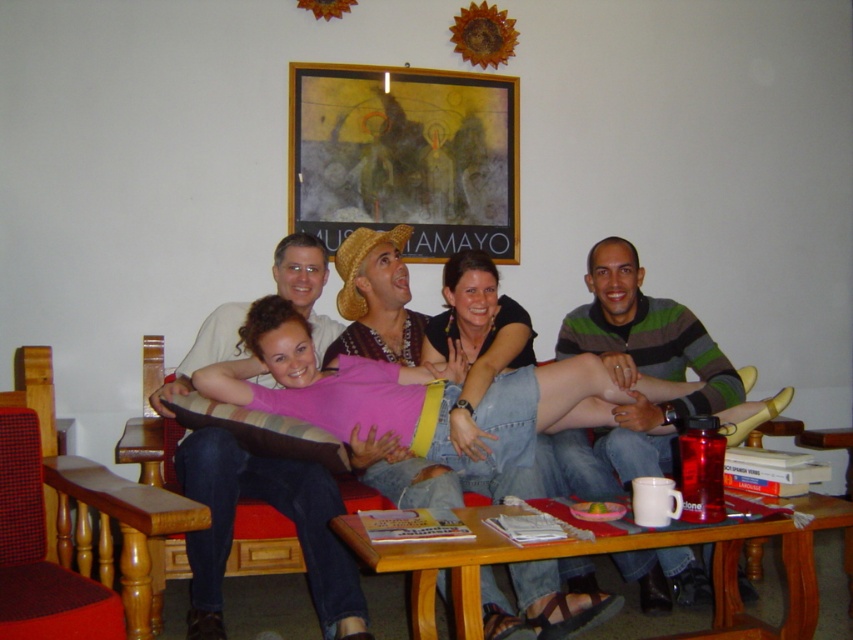
Between wooden picture frame at upper center and wooden table at lower center, which one appears on the right side from the viewer's perspective?

From the viewer's perspective, wooden table at lower center appears more on the right side.

Who is more distant from viewer, (509,182) or (415,611)?

The point (509,182) is more distant.

Locate an element on the screen. This screenshot has width=853, height=640. wooden picture frame at upper center is located at coordinates (405, 156).

Is point (555, 618) less distant than point (796, 593)?

No, (555, 618) is behind (796, 593).

Between point (549, 566) and point (473, 515), which one is positioned behind?

Point (549, 566)

Find the location of a particular element. The height and width of the screenshot is (640, 853). pink fabric pillow at center is located at coordinates (415, 403).

In the scene shown: Is pink fabric pillow at center smaller than wooden bench at lower left?

Actually, pink fabric pillow at center might be larger than wooden bench at lower left.

Does point (259, 369) come farther from viewer compared to point (106, 528)?

Yes, it is.

What do you see at coordinates (415, 403) in the screenshot? I see `pink fabric pillow at center` at bounding box center [415, 403].

The height and width of the screenshot is (640, 853). I want to click on pink fabric pillow at center, so click(415, 403).